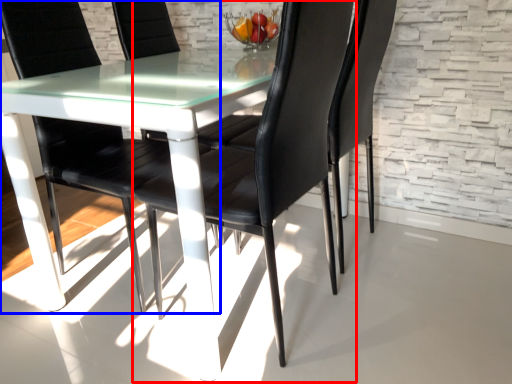
Question: Which object appears closest to the camera in this image, chair (highlighted by a red box) or chair (highlighted by a blue box)?

Choices:
 (A) chair
 (B) chair

Answer: (A)